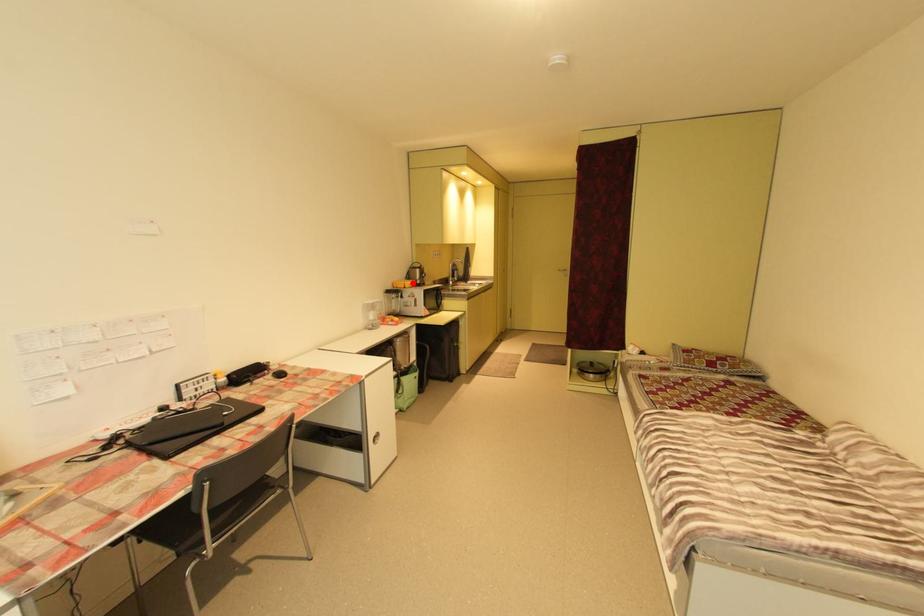
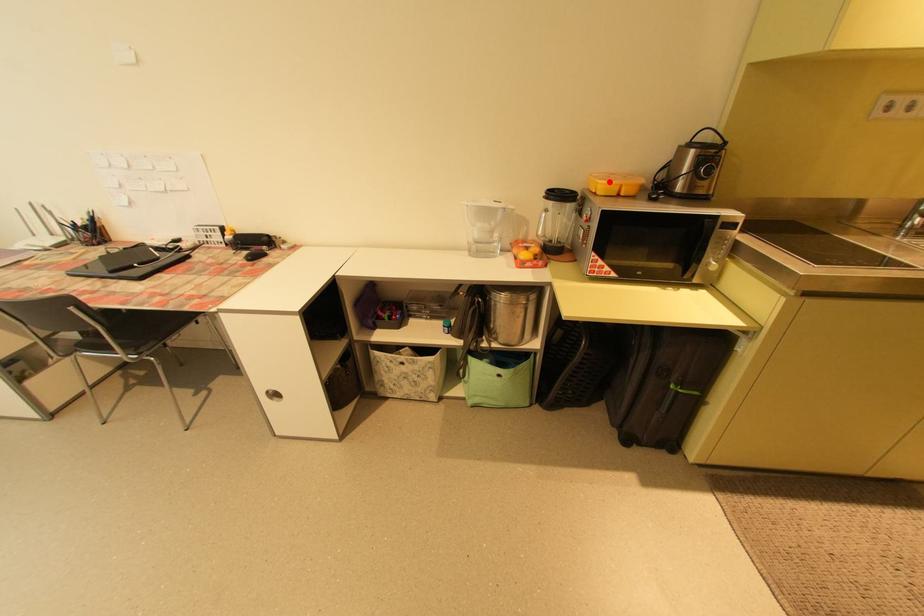
I am providing you with two images of the same scene from different viewpoints. A red point is marked on the first image and another point is marked on the second image. Is the marked point in image1 the same physical position as the marked point in image2?

Yes